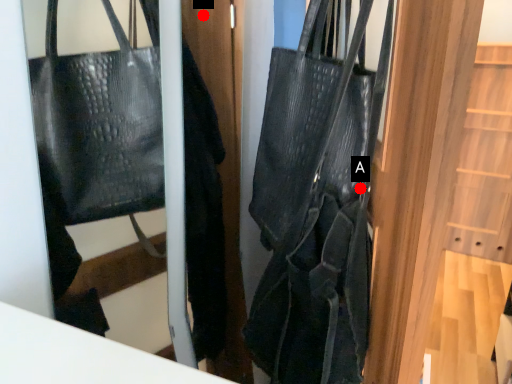
Question: Two points are circled on the image, labeled by A and B beside each circle. Which point is farther from the camera taking this photo?

Choices:
 (A) A is further
 (B) B is further

Answer: (B)